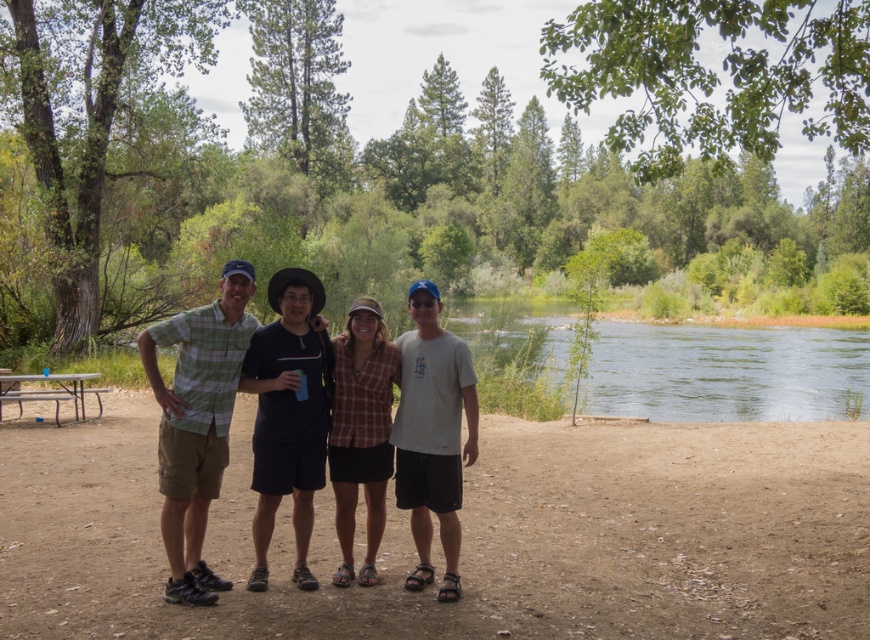
Question: Can you confirm if green plaid shirt at center is thinner than white cotton t-shirt at center?

Choices:
 (A) no
 (B) yes

Answer: (A)

Question: Which point appears farthest from the camera in this image?

Choices:
 (A) (211, 358)
 (B) (81, 408)
 (C) (413, 371)

Answer: (B)

Question: Which of the following is the farthest from the observer?

Choices:
 (A) (24, 400)
 (B) (248, 326)

Answer: (A)

Question: Does white cotton t-shirt at center appear under metallic silver picnic table at lower left?

Choices:
 (A) no
 (B) yes

Answer: (A)

Question: Where is green plaid shirt at center located in relation to metallic silver picnic table at lower left in the image?

Choices:
 (A) right
 (B) left

Answer: (A)

Question: Considering the real-world distances, which object is closest to the white cotton t-shirt at center?

Choices:
 (A) metallic silver picnic table at lower left
 (B) green plaid shirt at center

Answer: (B)